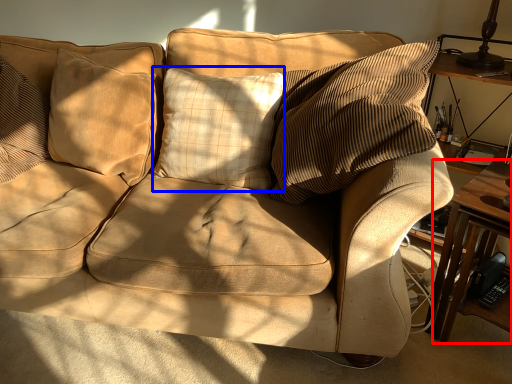
Question: Among these objects, which one is farthest to the camera, table (highlighted by a red box) or pillow (highlighted by a blue box)?

Choices:
 (A) table
 (B) pillow

Answer: (B)